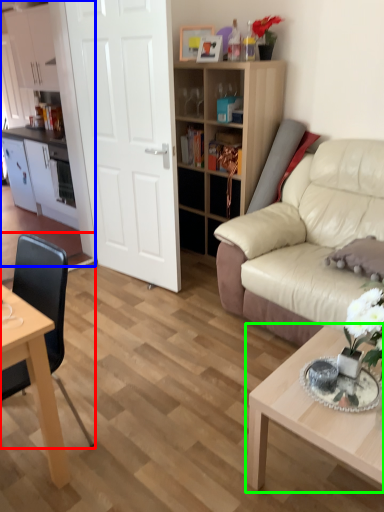
Question: Based on their relative distances, which object is farther from chair (highlighted by a red box)? Choose from entertainment center (highlighted by a blue box) and coffee table (highlighted by a green box).

Choices:
 (A) entertainment center
 (B) coffee table

Answer: (A)